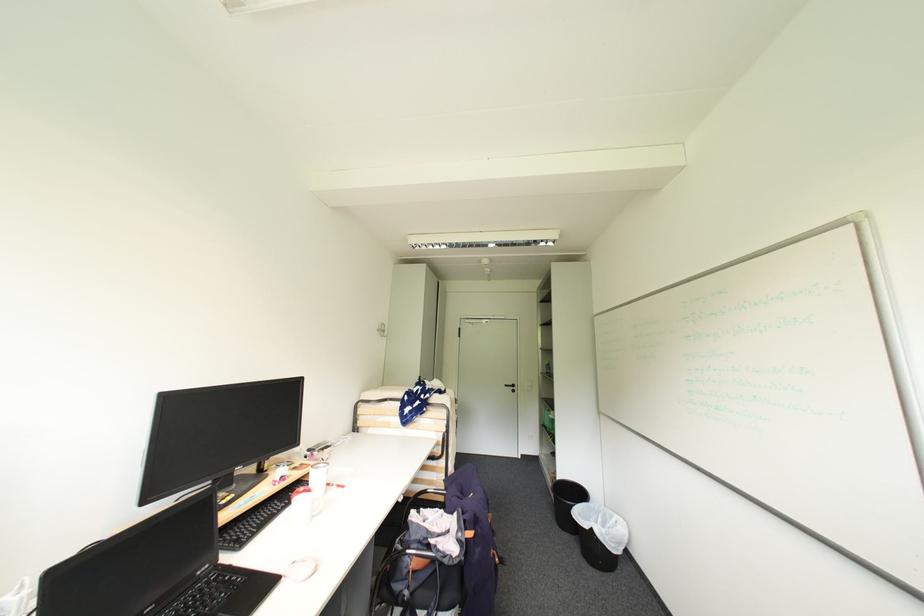
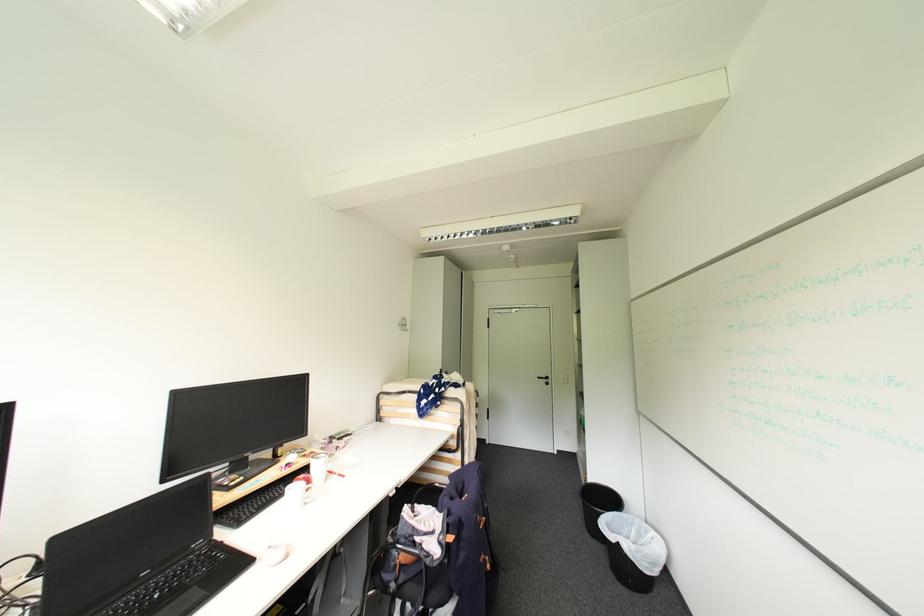
Where in the second image is the point corresponding to pixel 301 469 from the first image?

(311, 456)